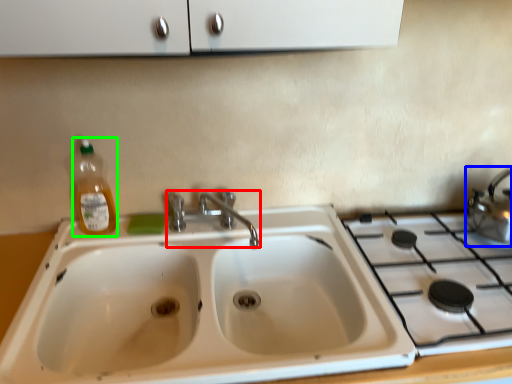
Question: Which is nearer to the tap (highlighted by a red box)? tea pot (highlighted by a blue box) or bottle (highlighted by a green box).

Choices:
 (A) tea pot
 (B) bottle

Answer: (B)